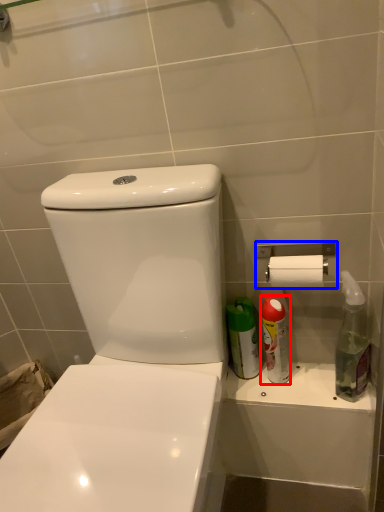
Question: Which of the following is the farthest to the observer, cleaning product (highlighted by a red box) or towel bar (highlighted by a blue box)?

Choices:
 (A) cleaning product
 (B) towel bar

Answer: (A)